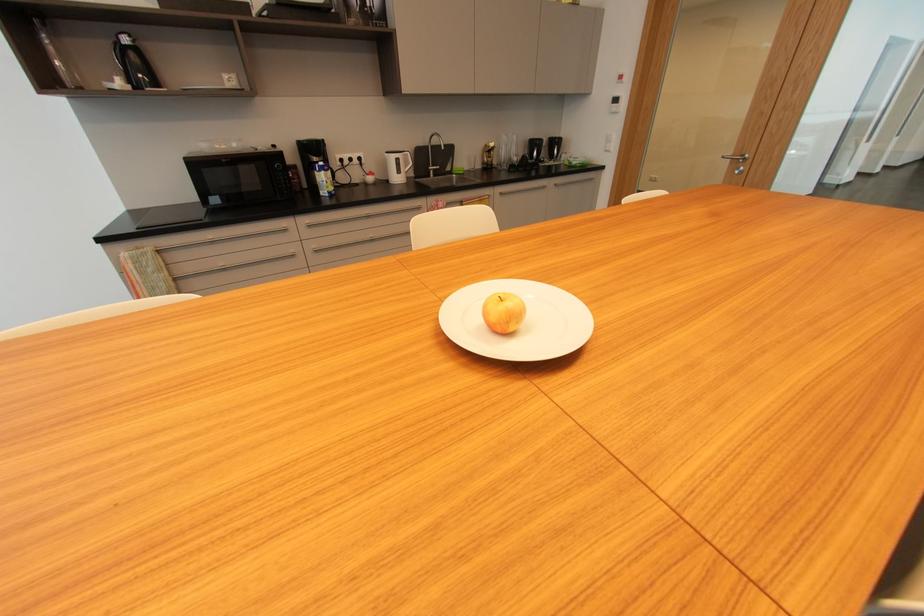
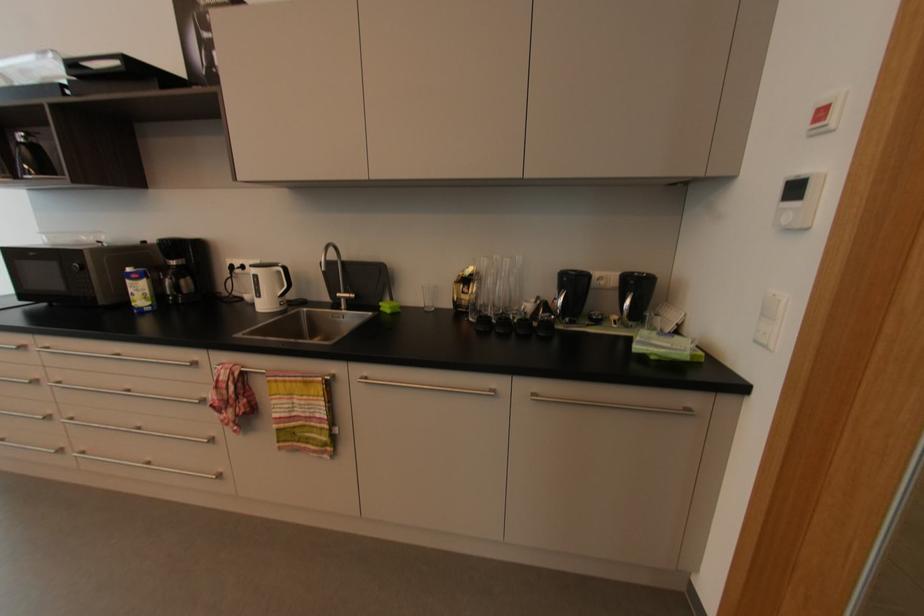
In the second image, find the point that corresponds to (438,169) in the first image.

(350, 300)